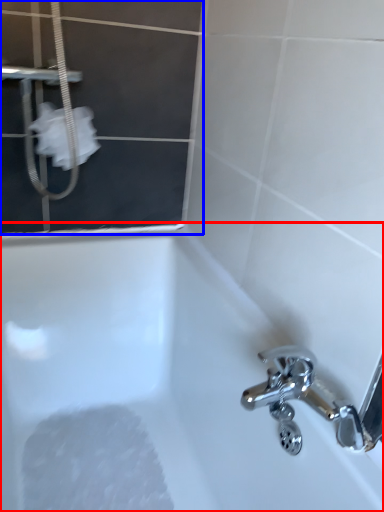
Question: Which object is closer to the camera taking this photo, bathtub (highlighted by a red box) or screen door (highlighted by a blue box)?

Choices:
 (A) bathtub
 (B) screen door

Answer: (A)